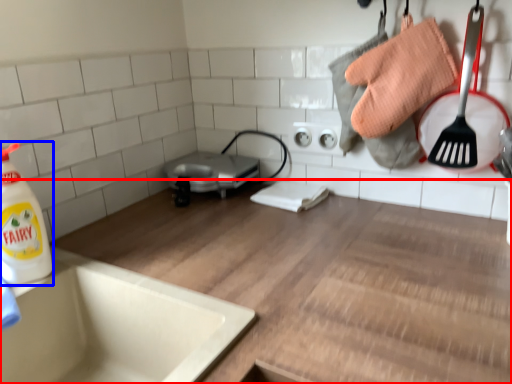
Question: Which object appears farthest to the camera in this image, countertop (highlighted by a red box) or cleaning product (highlighted by a blue box)?

Choices:
 (A) countertop
 (B) cleaning product

Answer: (B)